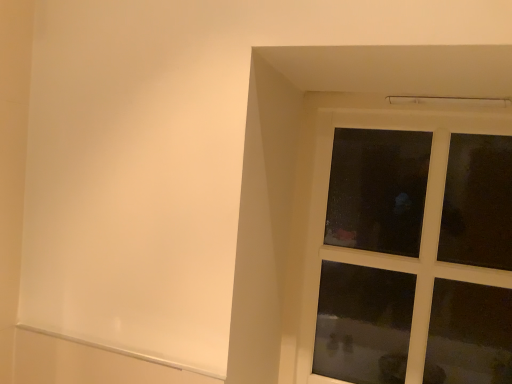
The height and width of the screenshot is (384, 512). What do you see at coordinates (379, 253) in the screenshot?
I see `transparent glass window at upper right` at bounding box center [379, 253].

Locate an element on the screen. This screenshot has width=512, height=384. transparent glass window at upper right is located at coordinates (379, 253).

I want to click on transparent glass window at upper right, so click(379, 253).